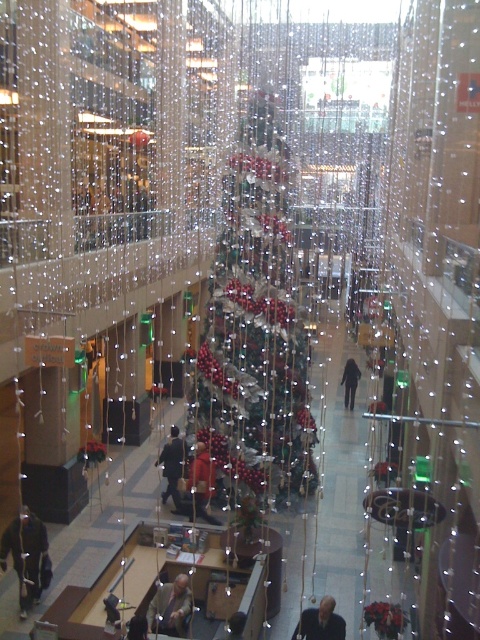
Question: Does dark gray coat at center have a larger size compared to dark gray suit at center?

Choices:
 (A) no
 (B) yes

Answer: (A)

Question: Is shiny metallic tree at center below dark gray suit at center?

Choices:
 (A) no
 (B) yes

Answer: (A)

Question: Which object is positioned farthest from the shiny metallic tree at center?

Choices:
 (A) dark gray coat at center
 (B) dark suit at lower center

Answer: (B)

Question: Can you confirm if shiny metallic tree at center is positioned to the right of dark gray coat at center?

Choices:
 (A) no
 (B) yes

Answer: (B)

Question: Which point appears closest to the camera in this image?

Choices:
 (A) tap(23, 547)
 (B) tap(175, 611)
 (C) tap(348, 369)
 (D) tap(282, 284)

Answer: (B)

Question: Estimate the real-world distances between objects in this image. Which object is farther from the dark brown leather jacket at center?

Choices:
 (A) light brown leather jacket at center
 (B) dark gray suit at center

Answer: (B)